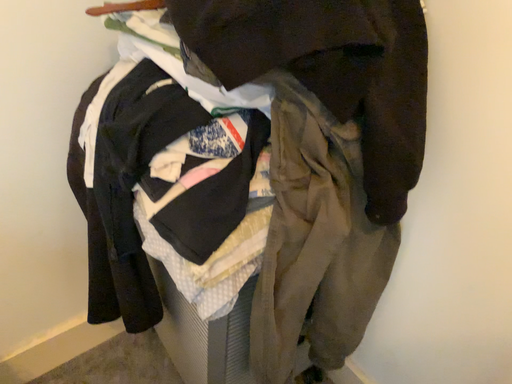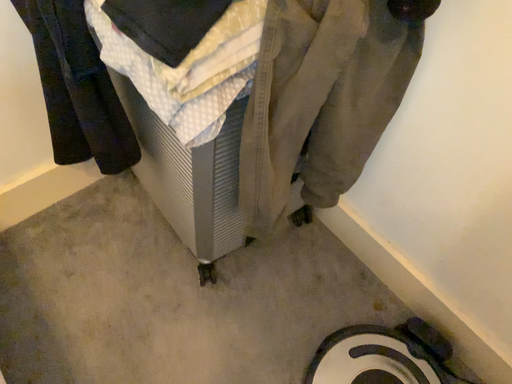
Question: Which way did the camera rotate in the video?

Choices:
 (A) rotated downward
 (B) rotated upward

Answer: (A)